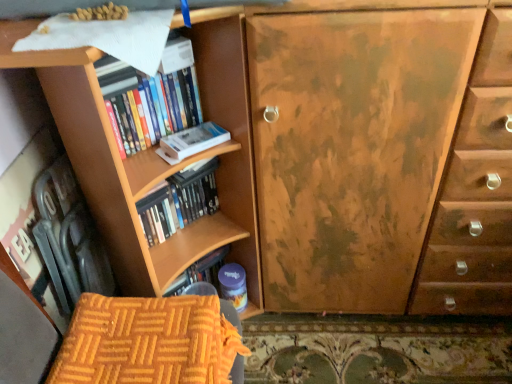
Identify the location of blank space situated above orange quilted fabric armchair at lower left (from a real-world perspective). The image size is (512, 384). (135, 335).